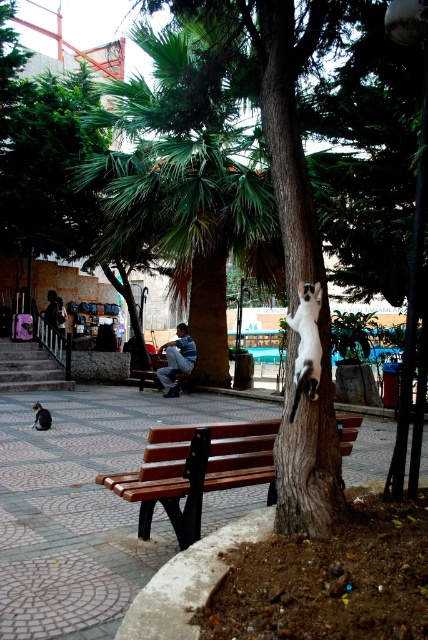
Question: Does brown wood bench at center have a greater width compared to denim pants at center?

Choices:
 (A) no
 (B) yes

Answer: (B)

Question: Which point appears closest to the camera in this image?

Choices:
 (A) (157, 358)
 (B) (168, 360)
 (C) (42, 422)

Answer: (C)

Question: Is white fur cat at center in front of brown wooden bench at center?

Choices:
 (A) no
 (B) yes

Answer: (B)

Question: Based on their relative distances, which object is nearer to the brown wooden bench at center?

Choices:
 (A) denim jacket at left
 (B) brown wood bench at center

Answer: (A)

Question: Which of these objects is positioned closest to the denim pants at center?

Choices:
 (A) brown wood bench at center
 (B) white fur cat at upper center

Answer: (B)

Question: Can you confirm if white fur cat at center is bigger than brown wooden bench at center?

Choices:
 (A) no
 (B) yes

Answer: (A)